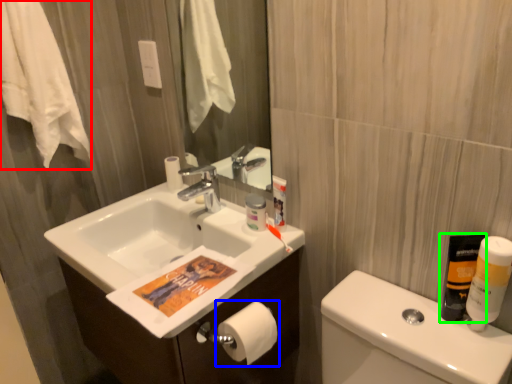
Question: Considering the real-world distances, which object is farthest from bath towel (highlighted by a red box)? toilet paper (highlighted by a blue box) or mouthwash (highlighted by a green box)?

Choices:
 (A) toilet paper
 (B) mouthwash

Answer: (B)